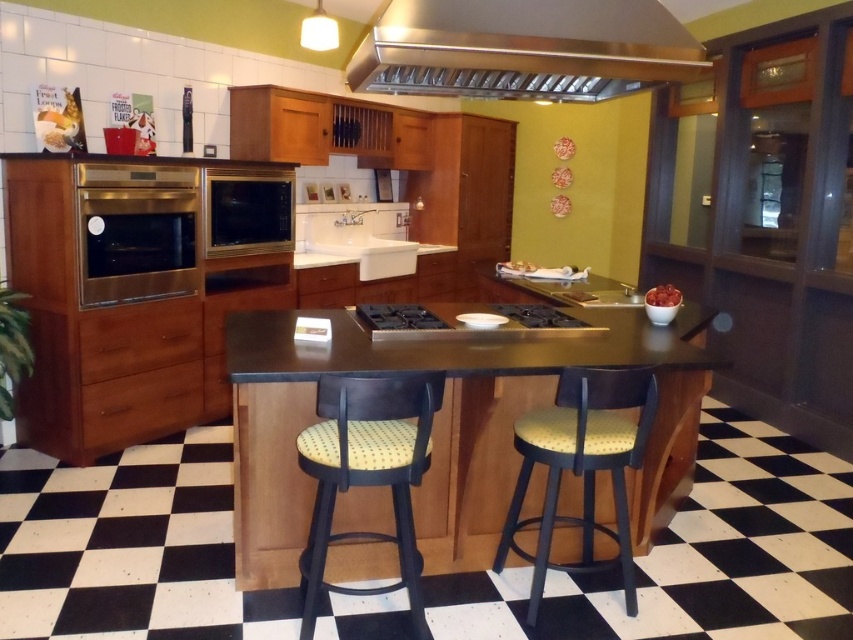
You are a chef preparing to host a dinner party and need to seat guests around the island. You have two stools available at the center of the kitchen. Which stool, the yellow fabric stool at center or the yellow dotted fabric stool at center, can accommodate more guests if you want to place them side by side?

The yellow dotted fabric stool at center has a greater width than the yellow fabric stool at center, so it can accommodate fewer guests when placed side by side. The narrower yellow fabric stool at center allows for more guests to be seated side by side.

You are a chef preparing to move the satin gold microwave at center closer to the sink. Which direction should you move it relative to the black stainless steel stove at center?

The satin gold microwave at center is positioned on the left side of the black stainless steel stove at center, so to move it closer to the sink, you should move it to the right side of the black stainless steel stove at center.

You are a guest entering the kitchen and see the yellow fabric stool at center and the yellow dotted fabric stool at center. Which stool is positioned lower in height?

The yellow fabric stool at center is positioned lower in height because it is located below the yellow dotted fabric stool at center.